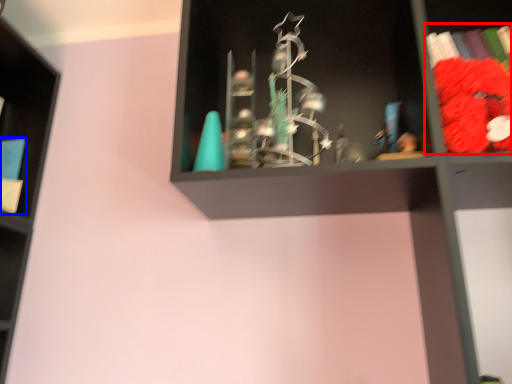
Question: Which object appears closest to the camera in this image, book (highlighted by a red box) or book (highlighted by a blue box)?

Choices:
 (A) book
 (B) book

Answer: (A)